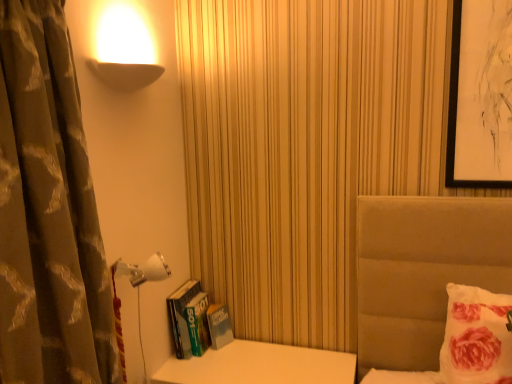
Where is `free location in front of hardcover book at left`? free location in front of hardcover book at left is located at coordinates pyautogui.click(x=187, y=372).